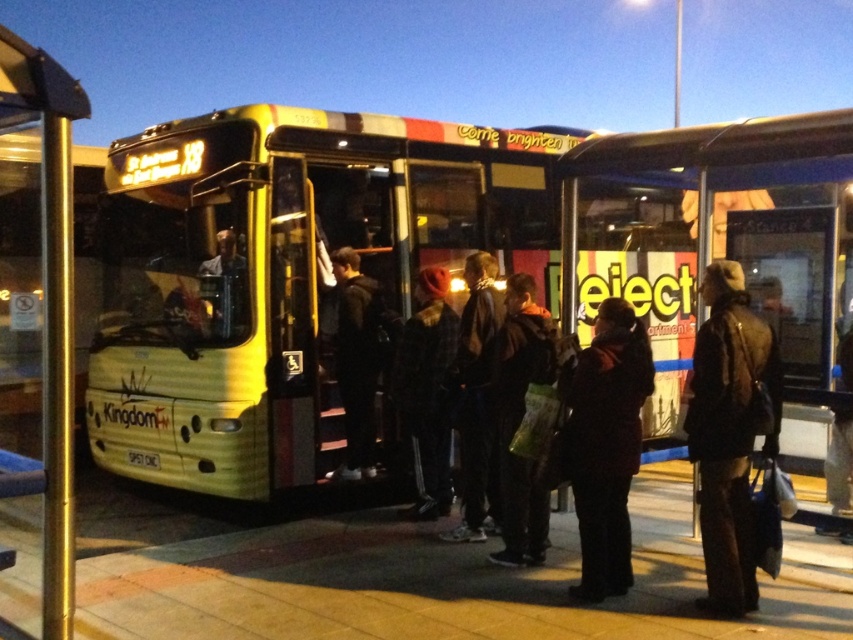
Can you confirm if metallic gold pole at left is taller than dark wool coat at center?

Indeed, metallic gold pole at left has a greater height compared to dark wool coat at center.

Locate an element on the screen. Image resolution: width=853 pixels, height=640 pixels. metallic gold pole at left is located at coordinates (49, 307).

Can you confirm if dark brown leather jacket at center is taller than dark wool coat at center?

Yes.

Can you confirm if dark brown leather jacket at center is positioned to the right of dark wool coat at center?

Correct, you'll find dark brown leather jacket at center to the right of dark wool coat at center.

Locate an element on the screen. This screenshot has height=640, width=853. dark brown leather jacket at center is located at coordinates (730, 432).

Between yellow metallic bus at center and metallic gold pole at left, which one is positioned higher?

yellow metallic bus at center

From the picture: Does yellow metallic bus at center have a smaller size compared to metallic gold pole at left?

Actually, yellow metallic bus at center might be larger than metallic gold pole at left.

Is point (202, 358) in front of point (0, 620)?

No, (202, 358) is behind (0, 620).

This screenshot has height=640, width=853. I want to click on yellow metallic bus at center, so click(281, 275).